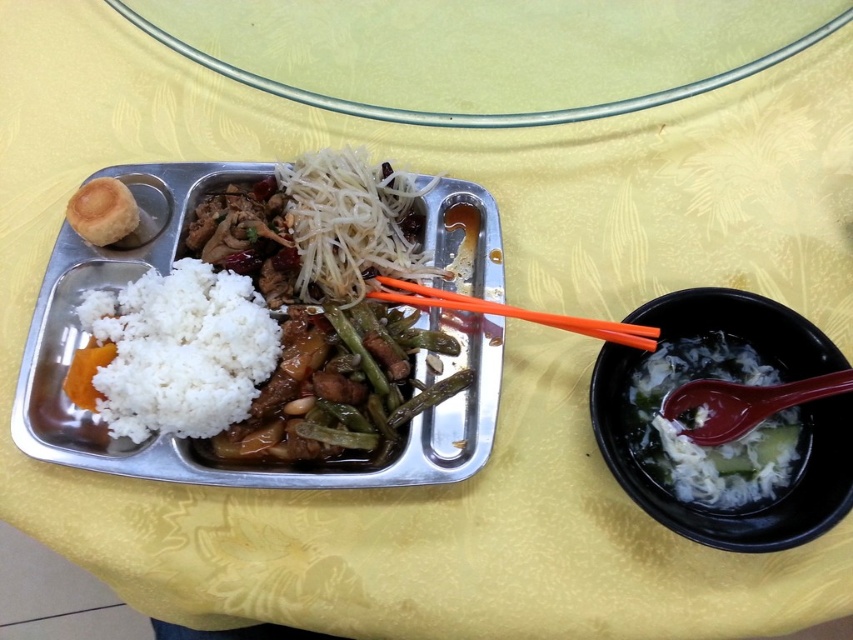
Is white matte rice at center smaller than white matte rice at center left?

No.

Does point (57, 275) lie in front of point (155, 394)?

No, it is not.

Between point (56, 436) and point (257, 348), which one is positioned in front?

Positioned in front is point (56, 436).

What are the coordinates of `white matte rice at center` in the screenshot? It's located at (199, 440).

Between transparent glass plate at upper center and matte brown bun at upper left, which one is positioned higher?

transparent glass plate at upper center is higher up.

Who is more forward, (474, 109) or (115, 186)?

Point (115, 186) is in front.

Locate an element on the screen. The height and width of the screenshot is (640, 853). transparent glass plate at upper center is located at coordinates (485, 51).

Locate an element on the screen. This screenshot has width=853, height=640. transparent glass plate at upper center is located at coordinates 485,51.

Is point (402, 288) in front of point (126, 205)?

No, it is behind (126, 205).

Does orange plastic chopsticks at center lie in front of matte brown bun at upper left?

That is True.

Describe the element at coordinates (514, 312) in the screenshot. I see `orange plastic chopsticks at center` at that location.

Where is `orange plastic chopsticks at center`? The image size is (853, 640). orange plastic chopsticks at center is located at coordinates (514, 312).